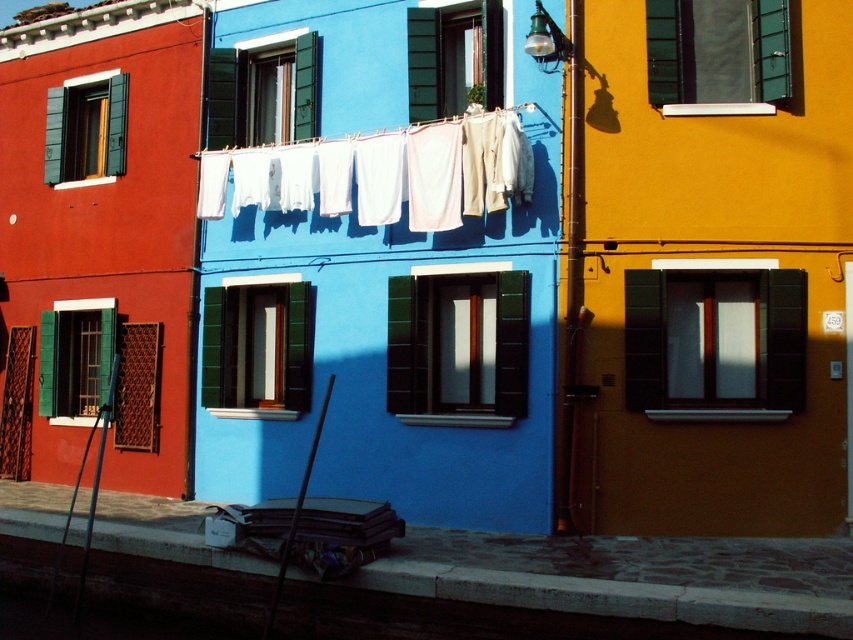
Measure the distance between point (93, 109) and camera.

The distance of point (93, 109) from camera is 17.50 meters.

Which is above, green matte shutter at upper left or green matte shutter at center?

green matte shutter at upper left is above.

Where is `green matte shutter at upper left`? Image resolution: width=853 pixels, height=640 pixels. green matte shutter at upper left is located at coordinates (86, 131).

At what (x,y) coordinates should I click in order to perform the action: click on green matte shutter at upper left. Please return your answer as a coordinate pair (x, y). Looking at the image, I should click on (86, 131).

In the scene shown: Is green matte shutter at upper center thinner than green matte shutter at center?

No.

Is point (691, 36) behind point (149, 349)?

No.

Is point (759, 74) farther from camera compared to point (123, 384)?

No, (759, 74) is closer to viewer.

The width and height of the screenshot is (853, 640). I want to click on green matte shutter at upper center, so click(x=717, y=51).

Does white cotton pants at center appear over green matte shutter at upper center?

No.

Locate an element on the screen. The height and width of the screenshot is (640, 853). white cotton pants at center is located at coordinates (405, 173).